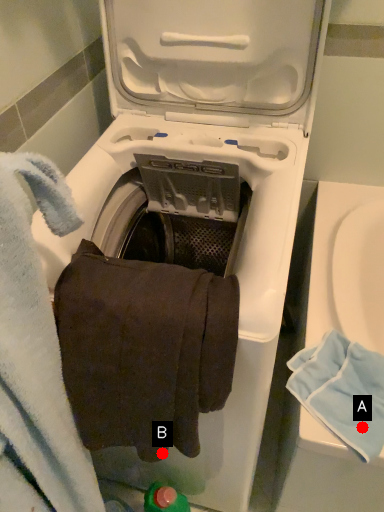
Question: Two points are circled on the image, labeled by A and B beside each circle. Among these points, which one is farthest from the camera?

Choices:
 (A) A is further
 (B) B is further

Answer: (A)